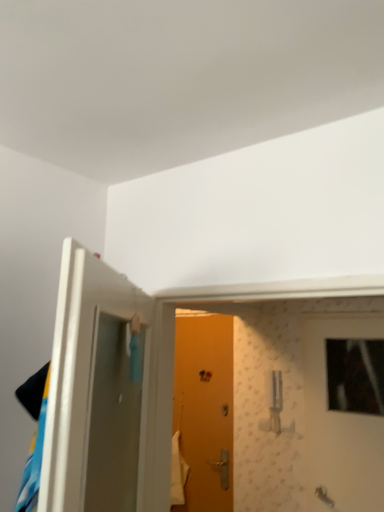
Question: Is wooden door at center, arranged as the first door when viewed from the right, taller or shorter than orange matte door at center, the third door from the front?

Choices:
 (A) tall
 (B) short

Answer: (B)

Question: Which is correct: wooden door at center, which is the 2th door from back to front, is inside orange matte door at center, the 1th door from the back, or outside of it?

Choices:
 (A) outside
 (B) inside

Answer: (A)

Question: Estimate the real-world distances between objects in this image. Which object is farther from the wooden door at center, which ranks as the 2th door in front-to-back order?

Choices:
 (A) orange matte door at center, the third door from the front
 (B) white glossy door at left, which is counted as the 1th door, starting from the front

Answer: (B)

Question: Which object is the closest to the wooden door at center, arranged as the first door when viewed from the right?

Choices:
 (A) white glossy door at left, the 3th door in the back-to-front sequence
 (B) orange matte door at center, the third door from the front

Answer: (B)